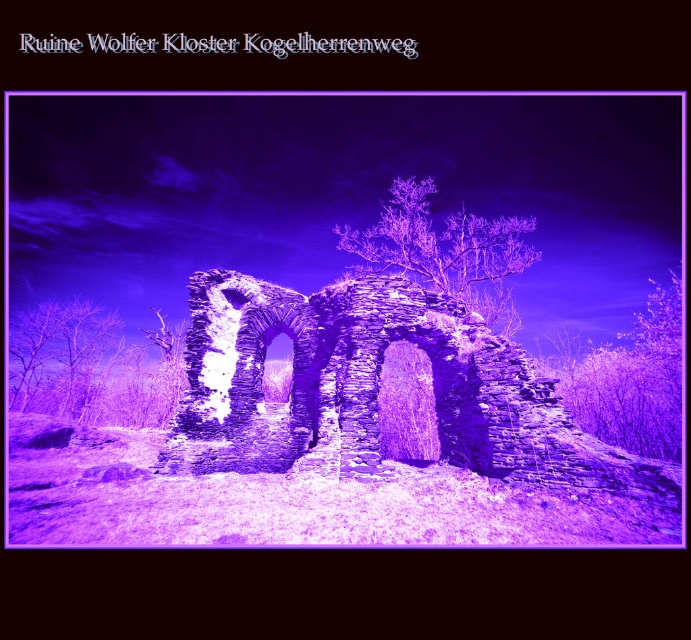
You are an artist planning to paint the ruins of Wolfer Kloster Kogelherrenweg. You want to ensure the purple textured tree at right and the purple stone tree at center are accurately sized relative to each other. Which of the two trees should you depict as larger in your painting?

The purple textured tree at right should be depicted as larger than the purple stone tree at center in your painting.

You are a drone operator tasked with capturing aerial footage of the ruins. The drone has a maximum flight range of 30 meters. If you are positioned at the stone arches at center, can you fly the drone to the purple textured tree at right without exceeding its range?

The stone arches at center and purple textured tree at right are 30.03 meters apart from each other. Since the drone has a maximum flight range of 30 meters, it cannot reach the purple textured tree at right without exceeding its range.